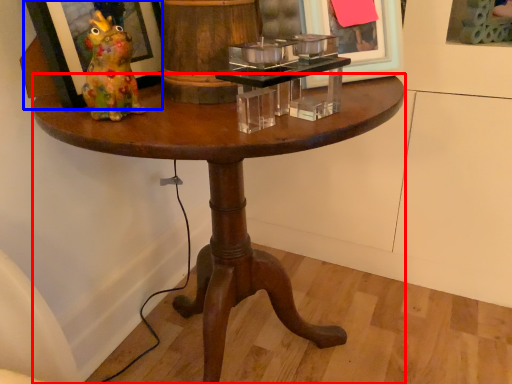
Question: Which of the following is the farthest to the observer, coffee table (highlighted by a red box) or picture frame (highlighted by a blue box)?

Choices:
 (A) coffee table
 (B) picture frame

Answer: (B)